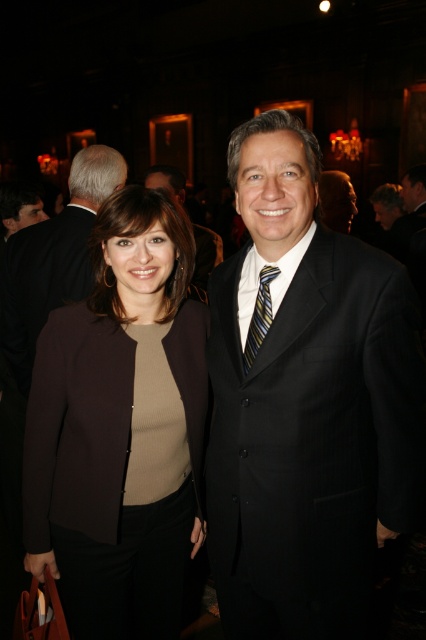
The height and width of the screenshot is (640, 426). What do you see at coordinates (19, 208) in the screenshot? I see `matte black suit at left` at bounding box center [19, 208].

Does matte black suit at left have a smaller size compared to striped silk tie at center?

Incorrect, matte black suit at left is not smaller in size than striped silk tie at center.

Is point (6, 218) farther from camera compared to point (273, 273)?

Yes, it is.

At what (x,y) coordinates should I click in order to perform the action: click on matte black suit at left. Please return your answer as a coordinate pair (x, y). The height and width of the screenshot is (640, 426). Looking at the image, I should click on (19, 208).

Is matte brown blazer at center bigger than matte black suit at left?

Indeed, matte brown blazer at center has a larger size compared to matte black suit at left.

Who is more distant from viewer, (183,492) or (31,193)?

Point (31,193)

Does point (60, 440) come farther from viewer compared to point (20, 211)?

No.

The image size is (426, 640). Find the location of `matte brown blazer at center`. matte brown blazer at center is located at coordinates (120, 428).

Locate an element on the screen. The image size is (426, 640). matte brown blazer at center is located at coordinates (120, 428).

Does point (72, 433) come behind point (264, 316)?

Yes, it is.

Locate an element on the screen. This screenshot has height=640, width=426. matte brown blazer at center is located at coordinates (120, 428).